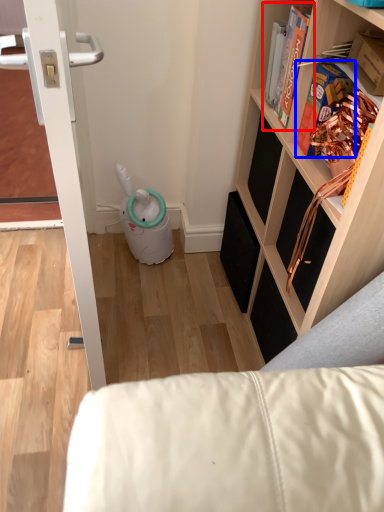
Question: Which object appears closest to the camera in this image, book (highlighted by a red box) or book (highlighted by a blue box)?

Choices:
 (A) book
 (B) book

Answer: (B)